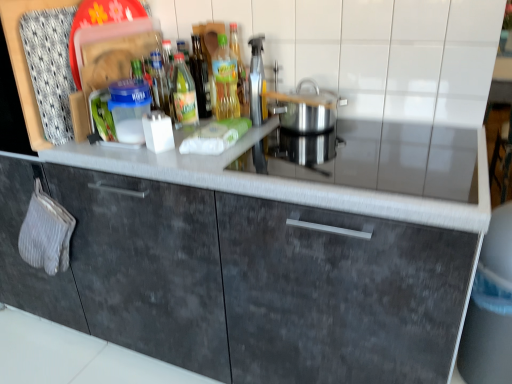
This screenshot has height=384, width=512. I want to click on free space above smooth gray countertop at center (from a real-world perspective), so click(x=346, y=162).